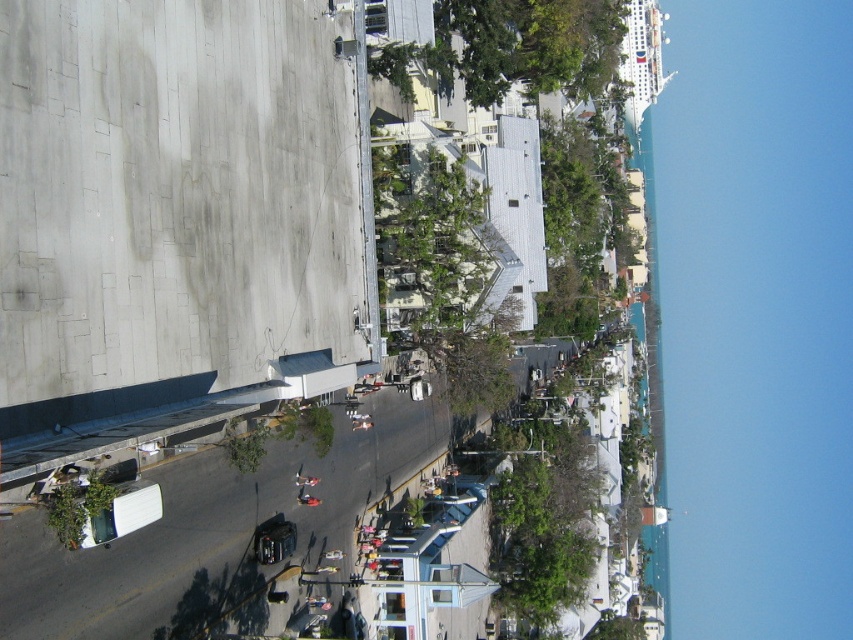
How much distance is there between green leafy tree at upper center and green leafy tree at center?

A distance of 50.63 feet exists between green leafy tree at upper center and green leafy tree at center.

Who is shorter, green leafy tree at upper center or green leafy tree at center?

green leafy tree at center is shorter.

Where is `green leafy tree at upper center`? This screenshot has width=853, height=640. green leafy tree at upper center is located at coordinates (511, 48).